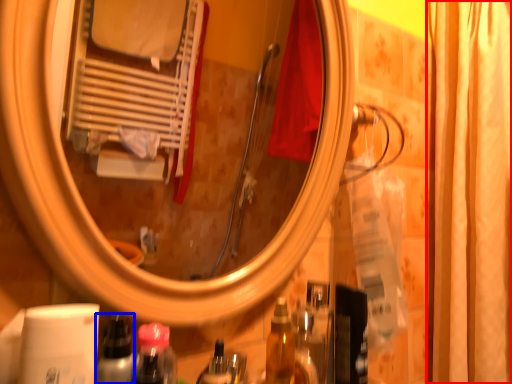
Question: Which of the following is the farthest to the observer, shower curtain (highlighted by a red box) or bottle (highlighted by a blue box)?

Choices:
 (A) shower curtain
 (B) bottle

Answer: (A)